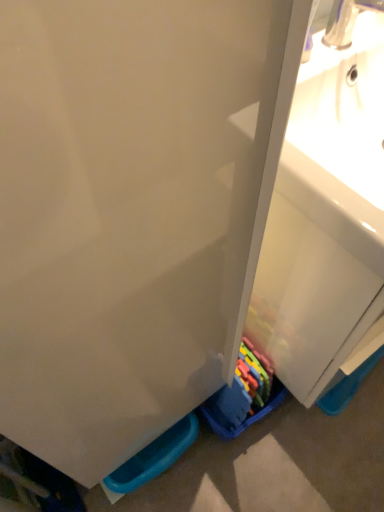
Question: Should I look upward or downward to see satin nickel faucet at upper right?

Choices:
 (A) up
 (B) down

Answer: (A)